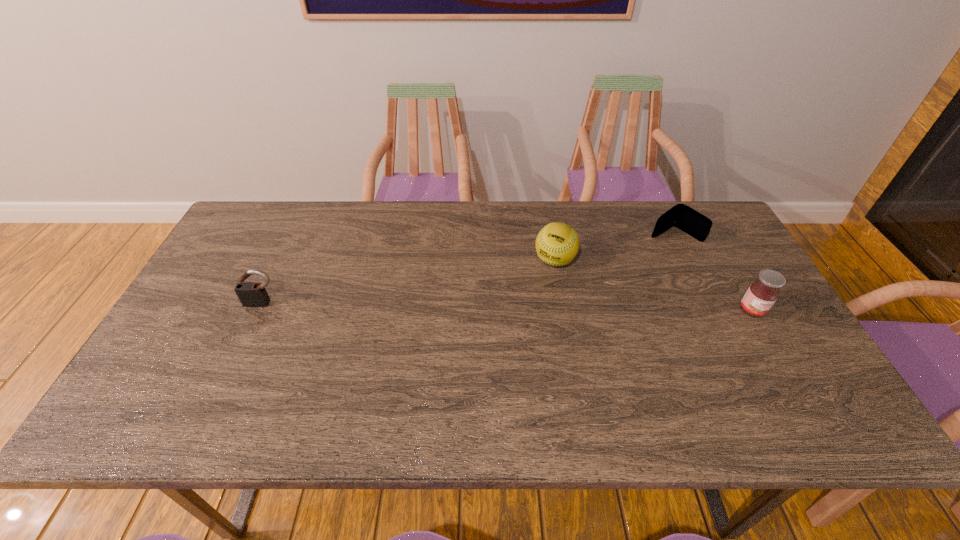
Image resolution: width=960 pixels, height=540 pixels. What are the coordinates of `free spot on the desktop that is between the padlock and the jam and is positioned on the logo side of the second object from left to right` in the screenshot? It's located at (527, 307).

Where is `vacant space on the desktop that is between the padlock and the jam and is positioned on the outer surface of the farthest object`? vacant space on the desktop that is between the padlock and the jam and is positioned on the outer surface of the farthest object is located at coordinates (563, 308).